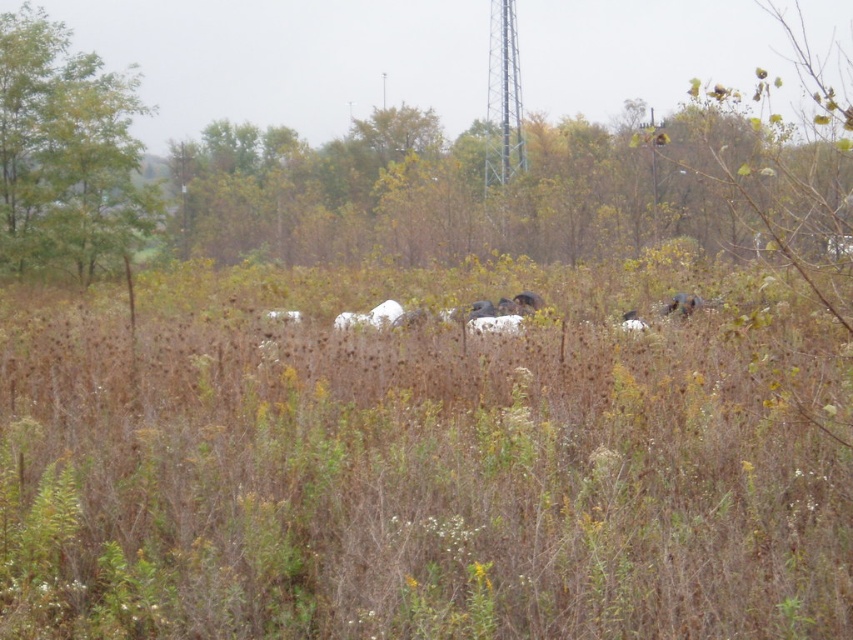
Question: Which point is closer to the camera?

Choices:
 (A) white matte hay bales at center
 (B) green leafy tree at upper center
 (C) green leafy tree at upper left

Answer: (A)

Question: Considering the relative positions of green leafy tree at upper center and brown furry animal at center-right in the image provided, where is green leafy tree at upper center located with respect to brown furry animal at center-right?

Choices:
 (A) above
 (B) below

Answer: (A)

Question: Which point appears closest to the camera in this image?

Choices:
 (A) (51, 154)
 (B) (363, 225)

Answer: (A)

Question: Which of the following is the closest to the observer?

Choices:
 (A) (560, 161)
 (B) (572, 369)
 (C) (39, 60)

Answer: (B)

Question: Where is green leafy tree at upper left located in relation to brown furry animal at center-right in the image?

Choices:
 (A) left
 (B) right

Answer: (A)

Question: Does green leafy tree at upper center appear under brown furry animal at center-right?

Choices:
 (A) no
 (B) yes

Answer: (A)